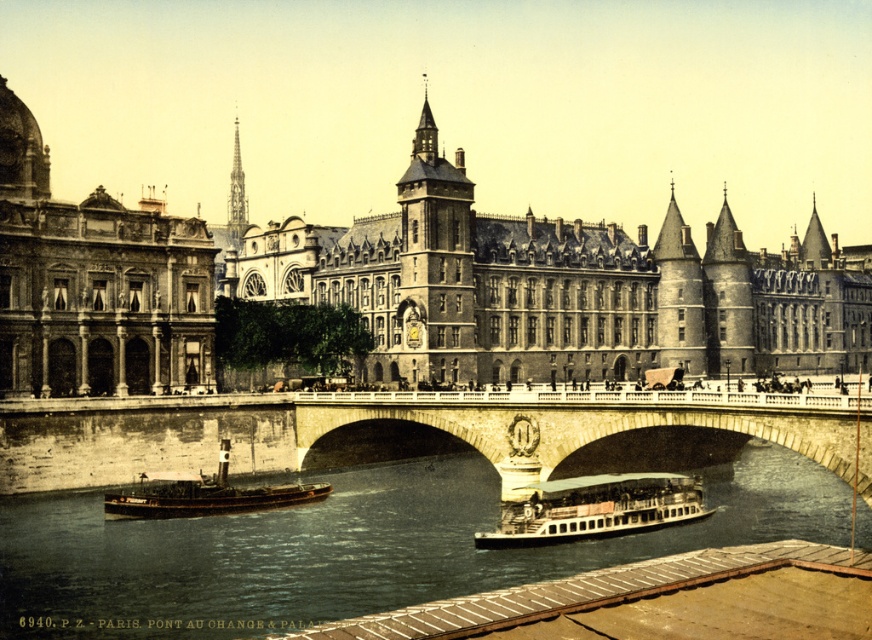
Question: Which point appears farthest from the camera in this image?

Choices:
 (A) (235, 136)
 (B) (445, 230)
 (C) (562, 493)

Answer: (A)

Question: Which object is closer to the camera taking this photo?

Choices:
 (A) brown wooden boat at lower left
 (B) matte stone building at center

Answer: (A)

Question: Estimate the real-world distances between objects in this image. Which object is farther from the smooth stone spire at upper center?

Choices:
 (A) brown wooden boat at lower left
 (B) wooden polished boat at center

Answer: (B)

Question: Is brown water at center thinner than wooden polished boat at center?

Choices:
 (A) yes
 (B) no

Answer: (B)

Question: Is brown water at center positioned before brown wooden boat at lower left?

Choices:
 (A) yes
 (B) no

Answer: (A)

Question: Can you confirm if brown wooden boat at lower left is positioned to the left of smooth stone spire at upper center?

Choices:
 (A) no
 (B) yes

Answer: (A)